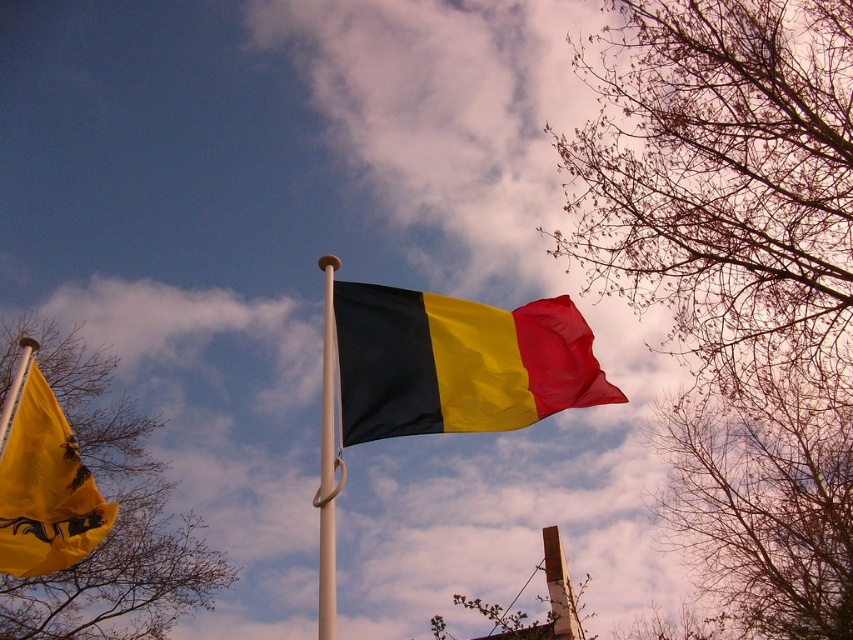
Between point (44, 353) and point (351, 323), which one is positioned behind?

The point (44, 353) is more distant.

Image resolution: width=853 pixels, height=640 pixels. Find the location of `bare branches at left`. bare branches at left is located at coordinates (117, 516).

Which is behind, point (225, 573) or point (421, 317)?

Positioned behind is point (225, 573).

Where is `bare branches at left`? bare branches at left is located at coordinates (117, 516).

Is black matte flag at center positioned at the back of white metallic flag pole at center?

Yes, it is.

Which is in front, point (450, 394) or point (323, 346)?

Point (450, 394) is more forward.

This screenshot has height=640, width=853. What are the coordinates of `black matte flag at center` in the screenshot? It's located at (457, 362).

Which is in front, point (722, 45) or point (55, 531)?

Point (55, 531)

Is bare branches at upper right positioned at the back of yellow fabric flag at left?

Yes.

Is point (708, 109) positioned in front of point (39, 513)?

No, (708, 109) is further to viewer.

I want to click on bare branches at upper right, so click(737, 276).